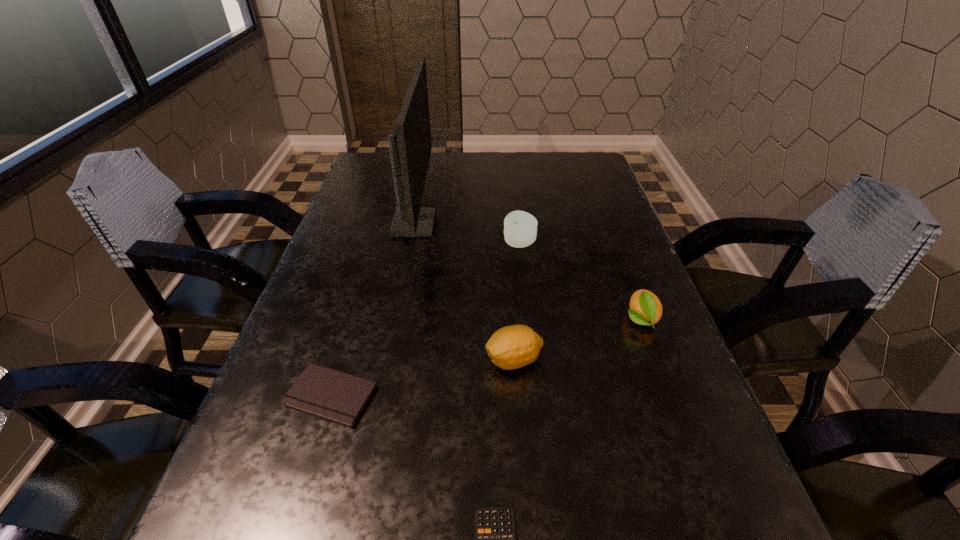
At what (x,y) coordinates should I click in order to perform the action: click on vacant position located 0.310m at the stem end of the left lemon. Please return your answer as a coordinate pair (x, y). This screenshot has width=960, height=540. Looking at the image, I should click on (320, 360).

Locate an element on the screen. This screenshot has width=960, height=540. free space located 0.280m with leaves positioned above the fourth nearest object is located at coordinates (701, 482).

Locate an element on the screen. Image resolution: width=960 pixels, height=540 pixels. free location located on the right of the second shortest object is located at coordinates (561, 395).

You are a GUI agent. You are given a task and a screenshot of the screen. Output one action in this format:
    pyautogui.click(x=<x>, y=<y>)
    Task: Click on the object that is at the far edge
    Image resolution: width=960 pixels, height=540 pixels.
    Given the screenshot: What is the action you would take?
    pyautogui.click(x=410, y=150)

The image size is (960, 540). I want to click on computer monitor present at the left edge, so click(410, 150).

Image resolution: width=960 pixels, height=540 pixels. I want to click on checkbook at the left edge, so click(x=336, y=396).

In order to click on object present at the right edge in this screenshot , I will do `click(646, 309)`.

Where is `object that is positioned at the far left corner`? object that is positioned at the far left corner is located at coordinates (410, 150).

The height and width of the screenshot is (540, 960). In order to click on vacant point at the left edge in this screenshot , I will do `click(240, 525)`.

Find the location of a particular element. Image resolution: width=960 pixels, height=540 pixels. vacant region at the right edge is located at coordinates (586, 207).